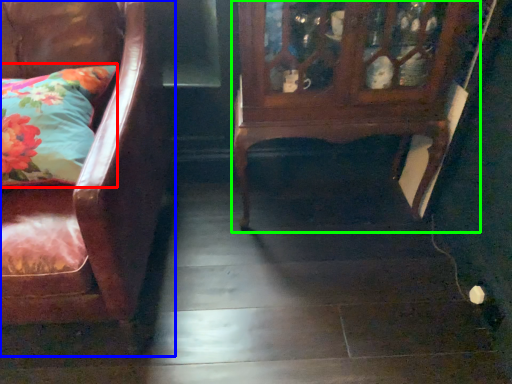
Question: Considering the real-world distances, which object is closest to pillow (highlighted by a red box)? chair (highlighted by a blue box) or furniture (highlighted by a green box).

Choices:
 (A) chair
 (B) furniture

Answer: (A)